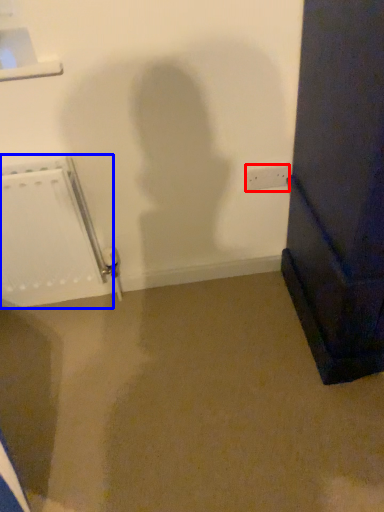
Question: Among these objects, which one is nearest to the camera, electric outlet (highlighted by a red box) or radiator (highlighted by a blue box)?

Choices:
 (A) electric outlet
 (B) radiator

Answer: (B)